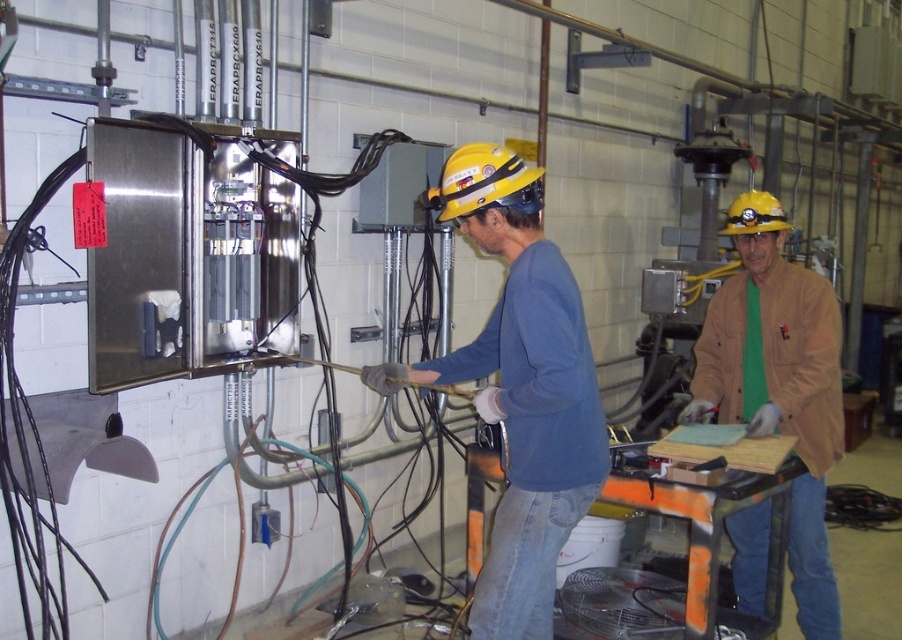
In the scene shown: Who is more distant from viewer, (445,161) or (767,196)?

Positioned behind is point (445,161).

The height and width of the screenshot is (640, 902). Describe the element at coordinates (484, 182) in the screenshot. I see `yellow hard hat at center` at that location.

Is point (465, 188) positioned after point (750, 228)?

That is False.

Identify the location of yellow hard hat at center. (484, 182).

Does point (528, 273) come in front of point (750, 209)?

Yes, it is.

Is blue matte shirt at center smaller than yellow hard hat at upper center?

Incorrect, blue matte shirt at center is not smaller in size than yellow hard hat at upper center.

Where is `blue matte shirt at center`? The height and width of the screenshot is (640, 902). blue matte shirt at center is located at coordinates point(519,387).

Which of these two, brown leather jacket at center or yellow hard hat at upper center, stands taller?

Standing taller between the two is brown leather jacket at center.

Does brown leather jacket at center have a lesser width compared to yellow hard hat at upper center?

Incorrect, brown leather jacket at center's width is not less than yellow hard hat at upper center's.

Measure the distance between brown leather jacket at center and camera.

brown leather jacket at center and camera are 2.91 meters apart from each other.

Locate an element on the screen. The height and width of the screenshot is (640, 902). brown leather jacket at center is located at coordinates (778, 384).